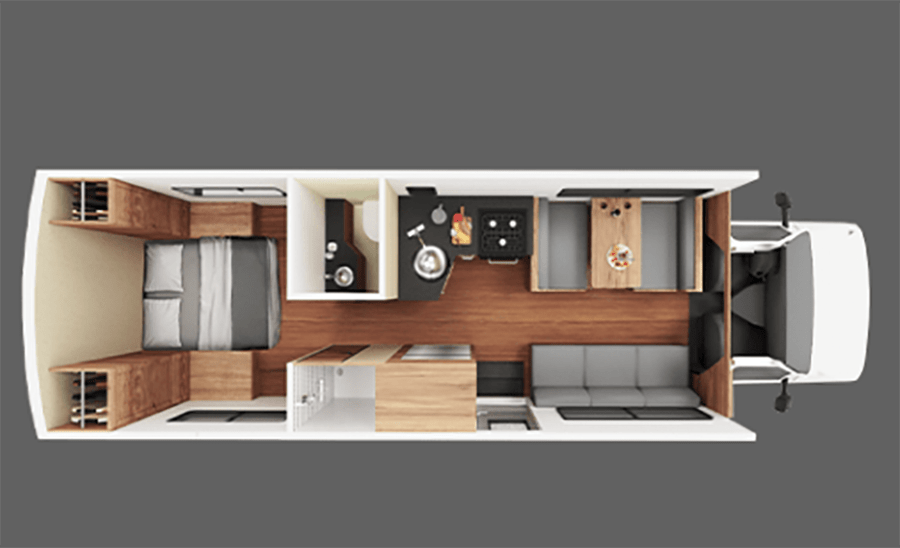
Image resolution: width=900 pixels, height=548 pixels. In order to click on bathroom in this screenshot , I will do `click(357, 392)`.